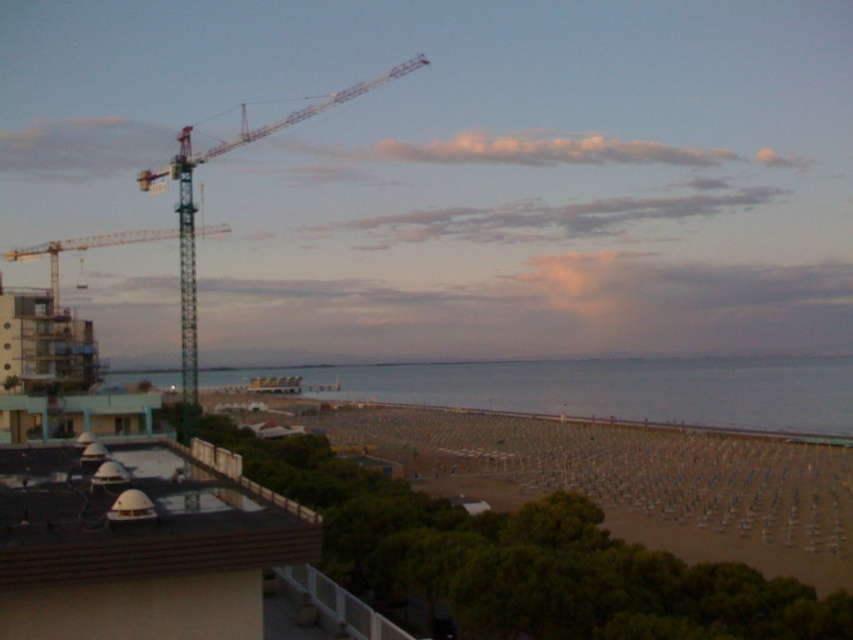
This screenshot has width=853, height=640. What do you see at coordinates (605, 388) in the screenshot?
I see `blue water at center` at bounding box center [605, 388].

What do you see at coordinates (605, 388) in the screenshot? I see `blue water at center` at bounding box center [605, 388].

The image size is (853, 640). I want to click on blue water at center, so click(605, 388).

Who is higher up, green metallic crane at upper left or yellow metallic crane at upper left?

green metallic crane at upper left

Is point (189, 336) in front of point (70, 248)?

Yes, point (189, 336) is closer to viewer.

I want to click on green metallic crane at upper left, so click(x=195, y=208).

Is blue water at center to the right of yellow metallic crane at upper left from the viewer's perspective?

Correct, you'll find blue water at center to the right of yellow metallic crane at upper left.

This screenshot has height=640, width=853. Identify the location of blue water at center. (605, 388).

The height and width of the screenshot is (640, 853). I want to click on blue water at center, so click(605, 388).